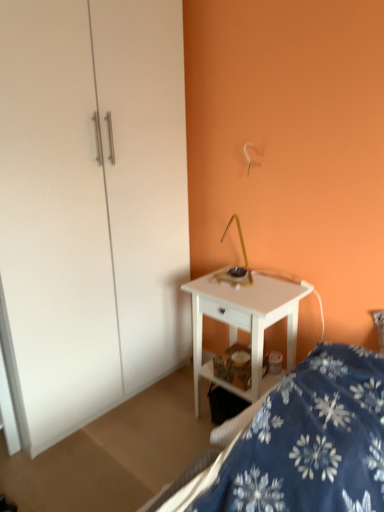
Question: Is blue floral fabric bed at lower right surrounding white glossy dresser at center?

Choices:
 (A) no
 (B) yes

Answer: (A)

Question: Can you confirm if blue floral fabric bed at lower right is shorter than white glossy dresser at center?

Choices:
 (A) yes
 (B) no

Answer: (A)

Question: Can you confirm if blue floral fabric bed at lower right is positioned to the left of white glossy dresser at center?

Choices:
 (A) yes
 (B) no

Answer: (B)

Question: Considering the relative sizes of blue floral fabric bed at lower right and white glossy dresser at center in the image provided, is blue floral fabric bed at lower right bigger than white glossy dresser at center?

Choices:
 (A) no
 (B) yes

Answer: (A)

Question: From a real-world perspective, is blue floral fabric bed at lower right on white glossy dresser at center?

Choices:
 (A) no
 (B) yes

Answer: (A)

Question: From the image's perspective, is blue floral fabric bed at lower right below white glossy dresser at center?

Choices:
 (A) yes
 (B) no

Answer: (A)

Question: Does white glossy desk at center have a smaller size compared to white glossy dresser at center?

Choices:
 (A) no
 (B) yes

Answer: (B)

Question: From a real-world perspective, does white glossy desk at center stand above white glossy dresser at center?

Choices:
 (A) no
 (B) yes

Answer: (A)

Question: Is white glossy desk at center beside white glossy dresser at center?

Choices:
 (A) yes
 (B) no

Answer: (B)

Question: Can you confirm if white glossy desk at center is positioned to the right of white glossy dresser at center?

Choices:
 (A) yes
 (B) no

Answer: (A)

Question: Is white glossy desk at center facing away from white glossy dresser at center?

Choices:
 (A) no
 (B) yes

Answer: (A)

Question: From a real-world perspective, is white glossy desk at center under white glossy dresser at center?

Choices:
 (A) no
 (B) yes

Answer: (B)

Question: From a real-world perspective, is white glossy desk at center beneath blue floral fabric bed at lower right?

Choices:
 (A) no
 (B) yes

Answer: (B)